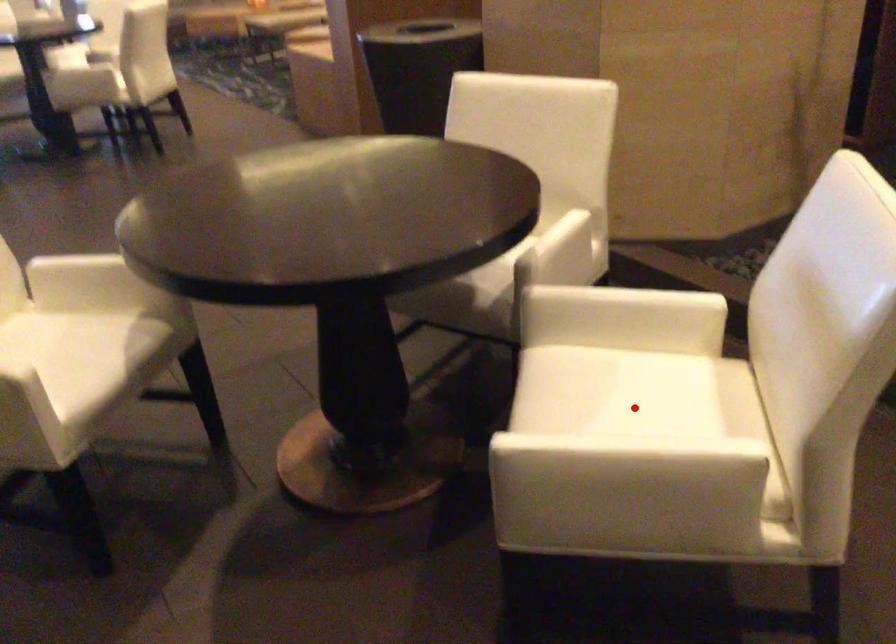
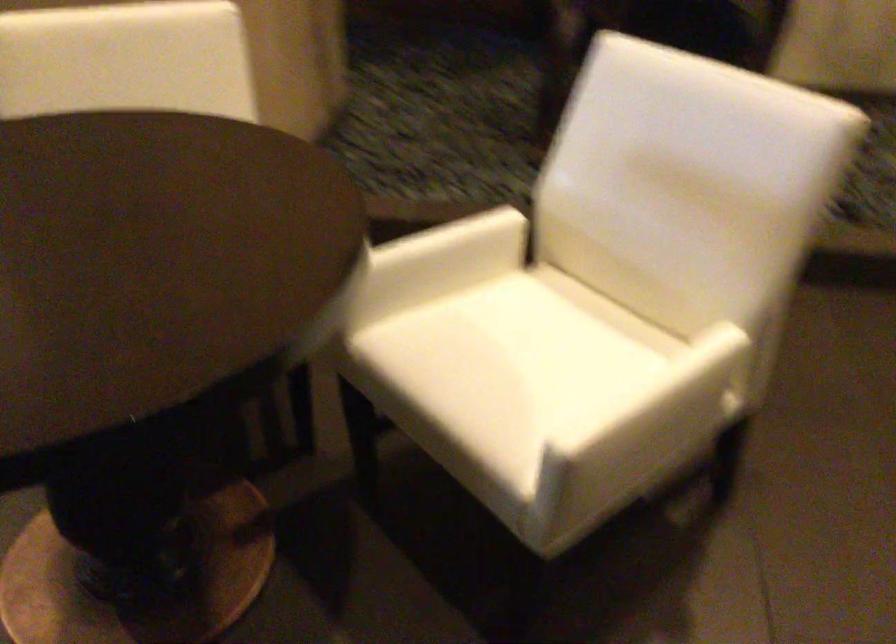
The point at the highlighted location is marked in the first image. Where is the corresponding point in the second image?

(533, 348)